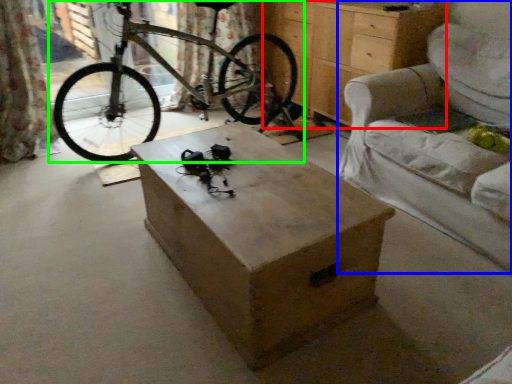
Question: Based on their relative distances, which object is farther from chest of drawers (highlighted by a red box)? Choose from armchair (highlighted by a blue box) and bicycle (highlighted by a green box).

Choices:
 (A) armchair
 (B) bicycle

Answer: (B)